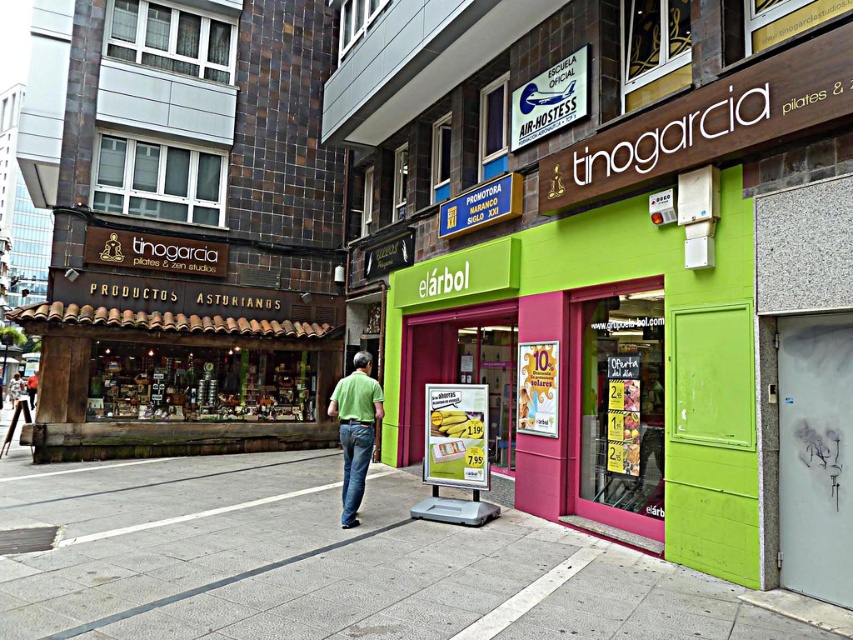
Question: Does gray concrete sidewalk at center appear on the right side of green matte storefront at center?

Choices:
 (A) no
 (B) yes

Answer: (A)

Question: Does gray concrete sidewalk at center come behind light green shirt at center?

Choices:
 (A) yes
 (B) no

Answer: (B)

Question: Which point is farther to the camera?

Choices:
 (A) gray concrete sidewalk at center
 (B) denim jeans at center
 (C) green fabric shirt at center

Answer: (C)

Question: Is the position of gray concrete sidewalk at center more distant than that of green fabric shirt at center?

Choices:
 (A) no
 (B) yes

Answer: (A)

Question: Which object is farther from the camera taking this photo?

Choices:
 (A) green matte shirt at center
 (B) denim jeans at center

Answer: (A)

Question: Which of the following is the farthest from the observer?

Choices:
 (A) (339, 390)
 (B) (28, 385)
 (C) (355, 424)

Answer: (B)